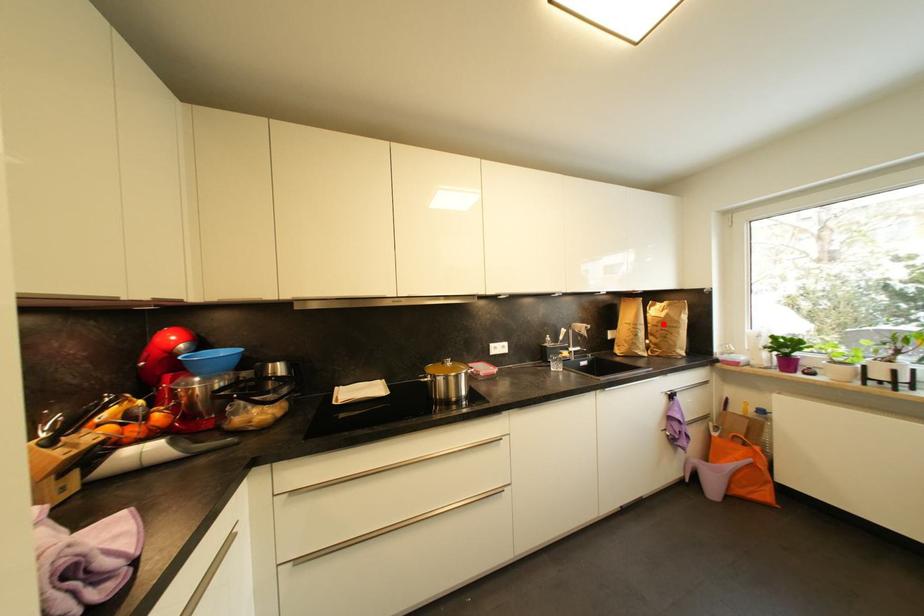
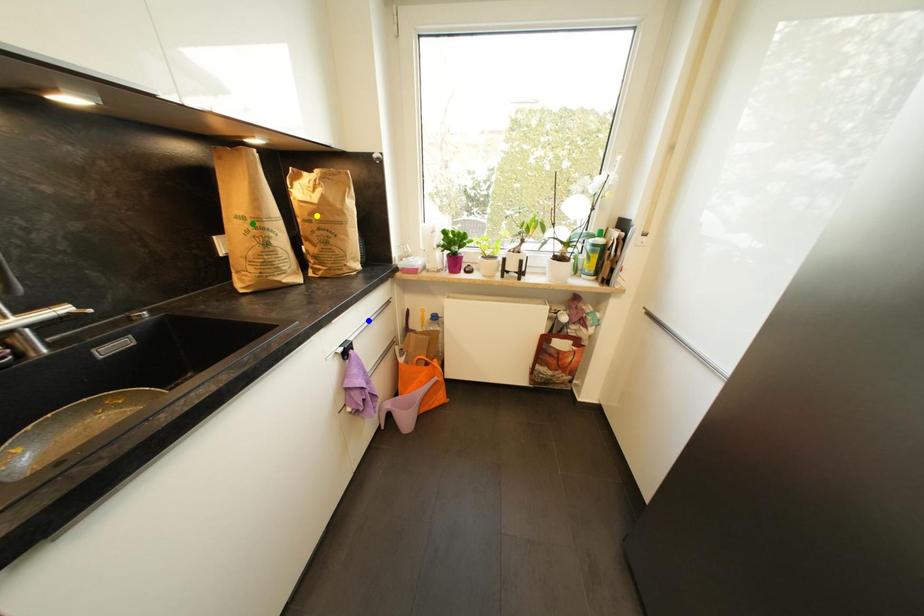
Question: I am providing you with two images of the same scene from different viewpoints. A red point is marked on the first image. You are given multiple points on the second image. Can you choose the point in image 2 that corresponds to the point in image 1?

Choices:
 (A) yellow point
 (B) blue point
 (C) green point

Answer: (A)